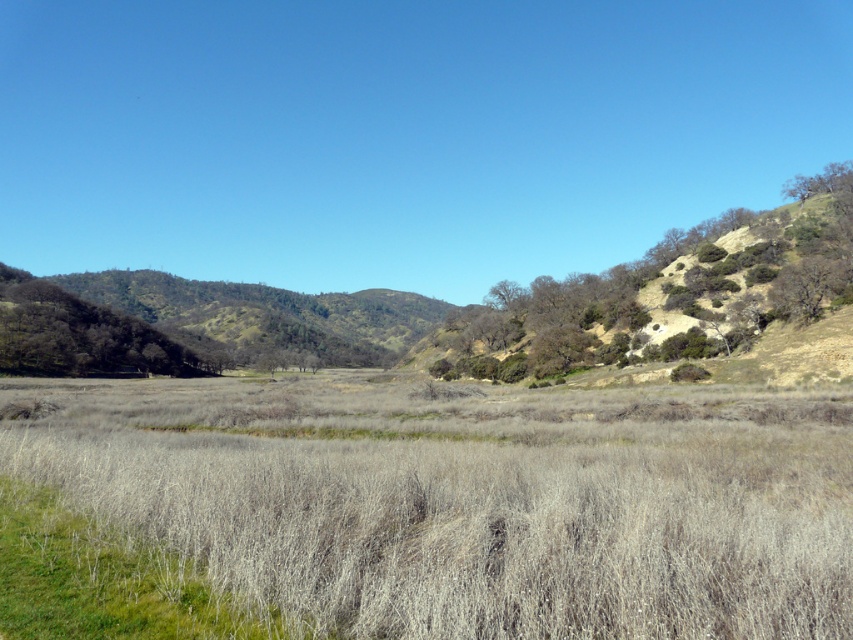
You are standing in the field of dry grasses in the foreground and want to walk towards the green leafy tree at right and the green leafy tree at left. Which tree will you encounter first as you move forward?

The green leafy tree at left will be encountered first because it is positioned lower in the image, meaning it is closer to the foreground where you are standing. The green leafy tree at right is above it, so it is farther away.

You are standing in the field of dry grasses and want to walk to the base of the green leafy tree at right. However, there is a green leafy tree at left in your path. Which tree will you encounter first?

The green leafy tree at left will be encountered first since it is closer to the observer in the field of dry grasses compared to the green leafy tree at right.